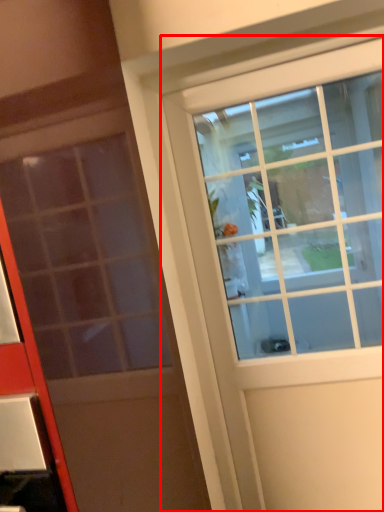
Question: From the image's perspective, where is door (annotated by the red box) located relative to door?

Choices:
 (A) below
 (B) above

Answer: (A)